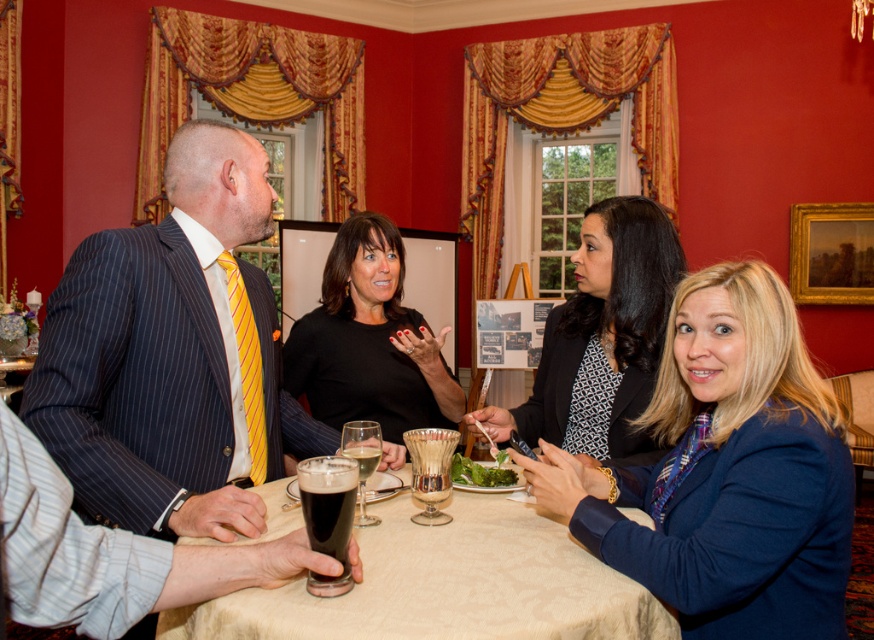
Which is behind, point (703, 528) or point (349, 483)?

The point (703, 528) is more distant.

Which of these two, blue fabric jacket at lower right or dark glass beer at center, stands taller?

With more height is blue fabric jacket at lower right.

Describe the element at coordinates (727, 472) in the screenshot. I see `blue fabric jacket at lower right` at that location.

Locate an element on the screen. The width and height of the screenshot is (874, 640). blue fabric jacket at lower right is located at coordinates (x=727, y=472).

Image resolution: width=874 pixels, height=640 pixels. What do you see at coordinates (328, 515) in the screenshot?
I see `dark glass beer at center` at bounding box center [328, 515].

Does dark glass beer at center have a lesser width compared to translucent glass at center?

Incorrect, dark glass beer at center's width is not less than translucent glass at center's.

Between point (306, 484) and point (371, 451), which one is positioned in front?

Point (306, 484) is more forward.

Locate an element on the screen. This screenshot has width=874, height=640. dark glass beer at center is located at coordinates (328, 515).

Which of these two, blue fabric jacket at lower right or black matte shirt at center, stands shorter?

blue fabric jacket at lower right is shorter.

Who is more forward, [815,371] or [365,296]?

Point [815,371] is more forward.

The width and height of the screenshot is (874, 640). I want to click on blue fabric jacket at lower right, so click(727, 472).